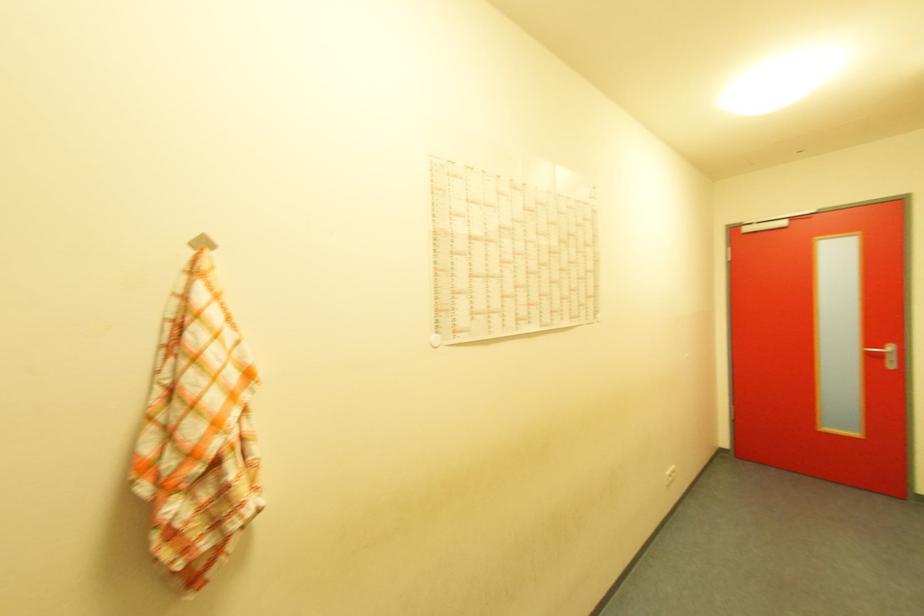
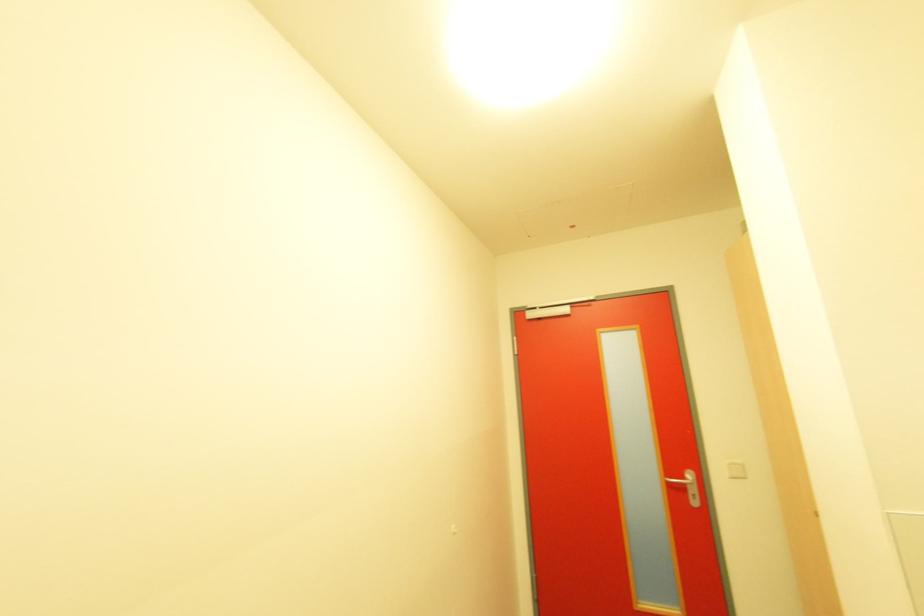
Which direction would the cameraman need to move to produce the second image?

The cameraman moved toward right, forward.